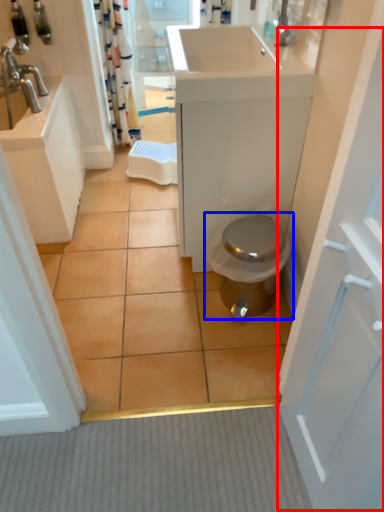
Question: Which object is closer to the camera taking this photo, screen door (highlighted by a red box) or toilet (highlighted by a blue box)?

Choices:
 (A) screen door
 (B) toilet

Answer: (A)